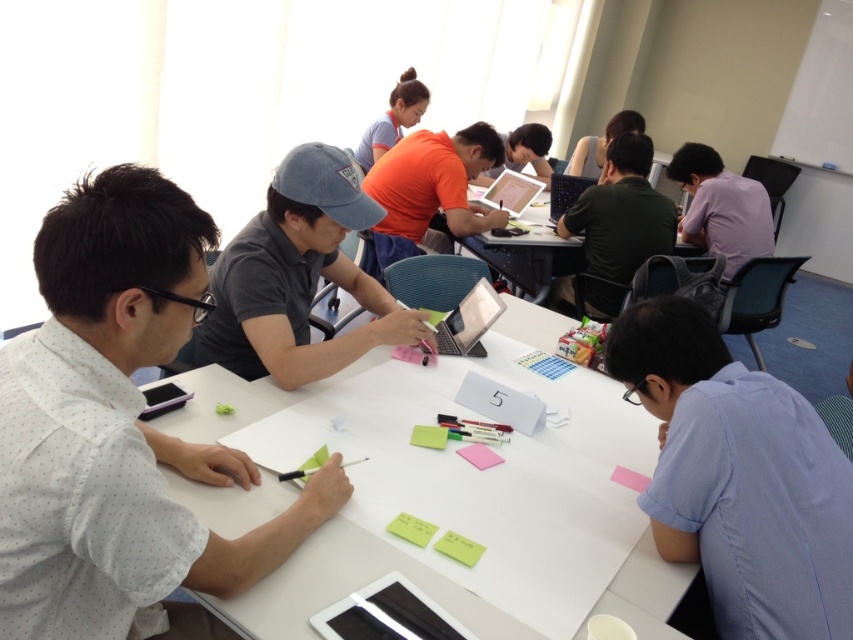
You are organizing a workshop and need to place a new sticky note on the table. The yellow matte sticky notes at center are already present. Where should you place the new pink matte sticky note at center so that it is larger than the existing ones?

Place the new pink matte sticky note at center next to the yellow matte sticky notes at center. Since the pink matte sticky note at center is larger in size compared to the yellow matte sticky notes at center, it will stand out more in the same area.

You are standing at the center of the room and want to locate the purple cotton shirt at upper right. According to the coordinates provided, in which direction should you look to find it?

The purple cotton shirt at upper right is located at coordinates point [721,212]. Since you are at the center, you should look towards the upper right direction to find it.

You are a photographer standing at the entrance of the room. You want to take a photo of the satin silver laptop at center and the purple cotton shirt at upper right. Which object should you position closer to the left side of the camera frame?

The satin silver laptop at center should be positioned closer to the left side of the camera frame because the purple cotton shirt at upper right is to the right of it.